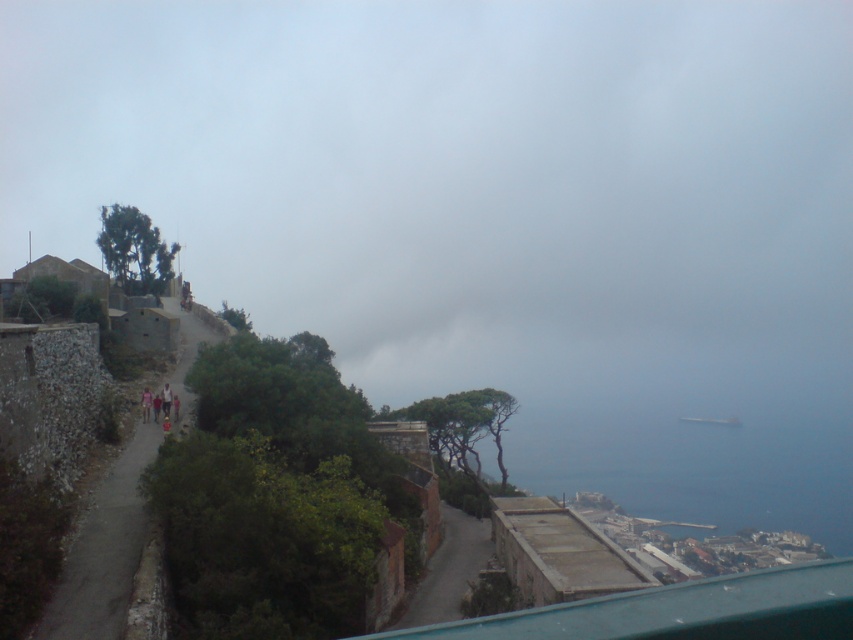
Which is in front, point (663, 122) or point (718, 429)?

Point (718, 429) is in front.

Does gray fog at upper center have a lesser width compared to blue water at lower right?

No, gray fog at upper center is not thinner than blue water at lower right.

Is point (688, 128) positioned behind point (518, 474)?

Yes, point (688, 128) is farther from viewer.

The image size is (853, 640). I want to click on gray fog at upper center, so click(x=469, y=186).